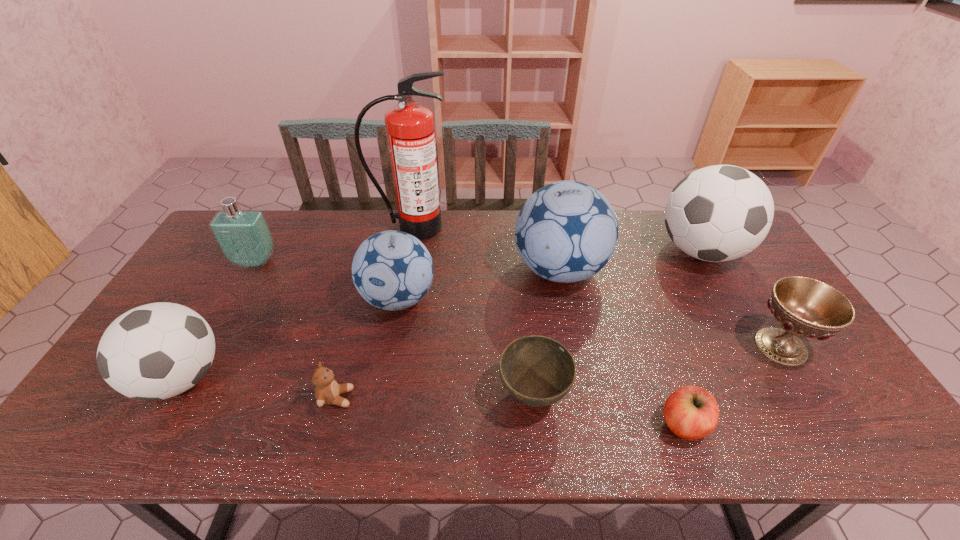
The height and width of the screenshot is (540, 960). Identify the location of vacant space situated on the side with brand of the bigger blue soccer ball. (415, 270).

Where is `vacant space situated on the front label of the perfume`? vacant space situated on the front label of the perfume is located at coordinates (205, 349).

At what (x,y) coordinates should I click in order to perform the action: click on vacant space located 0.060m on the side with brand of the left blue soccer ball. Please return your answer as a coordinate pair (x, y). The width and height of the screenshot is (960, 540). Looking at the image, I should click on (390, 345).

What are the coordinates of `vacant area located on the right of the leftmost soccer ball` in the screenshot? It's located at (318, 379).

Find the location of `free space located 0.160m on the back of the red chalice`. free space located 0.160m on the back of the red chalice is located at coordinates (741, 282).

Image resolution: width=960 pixels, height=540 pixels. In order to click on free space located on the left of the bowl in this screenshot , I will do `click(403, 394)`.

This screenshot has width=960, height=540. In order to click on vacant position located 0.090m on the front-facing side of the teddy bear in this screenshot , I will do `click(390, 397)`.

Find the location of a particular element. The width and height of the screenshot is (960, 540). vacant space located 0.100m on the right of the apple is located at coordinates (752, 424).

Locate an element on the screen. Image resolution: width=960 pixels, height=540 pixels. fire extinguisher at the far edge is located at coordinates coord(410,130).

The width and height of the screenshot is (960, 540). I want to click on soccer ball that is at the near edge, so click(x=156, y=351).